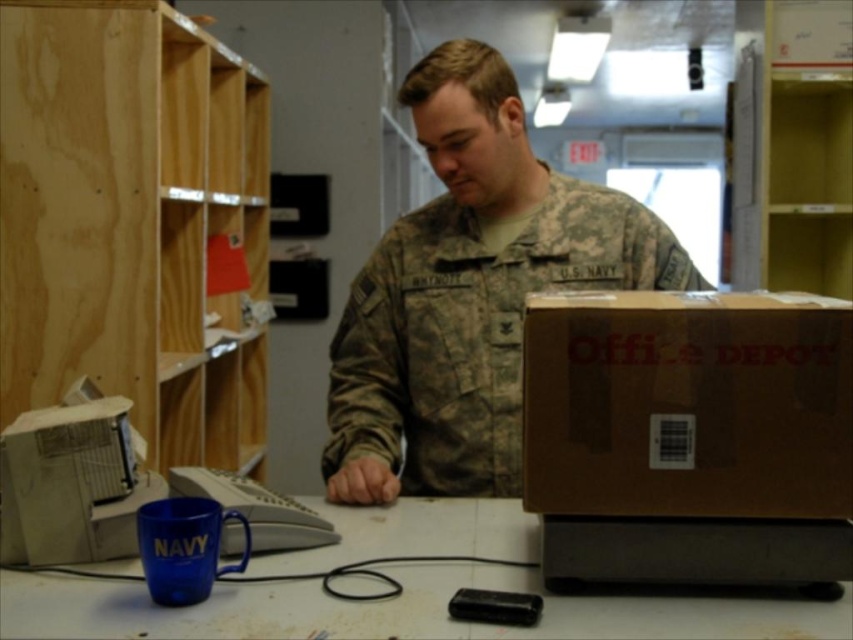
Question: Which point is farther to the camera?

Choices:
 (A) (805, 339)
 (B) (556, 216)
 (C) (144, 285)
 (D) (401, 552)

Answer: (C)

Question: Among these points, which one is farthest from the camera?

Choices:
 (A) (421, 310)
 (B) (94, 348)
 (C) (103, 625)

Answer: (B)

Question: Can you confirm if camouflage uniform at center is positioned below blue plastic cup at lower center?

Choices:
 (A) no
 (B) yes

Answer: (A)

Question: Which point is closer to the camera?

Choices:
 (A) (403, 99)
 (B) (57, 51)
 (C) (675, 625)
 (D) (676, 429)

Answer: (C)

Question: Can you confirm if light wood bookshelf at left is smaller than blue plastic cup at lower center?

Choices:
 (A) no
 (B) yes

Answer: (A)

Question: Does brown cardboard box at right appear on the left side of blue plastic cup at lower center?

Choices:
 (A) yes
 (B) no

Answer: (B)